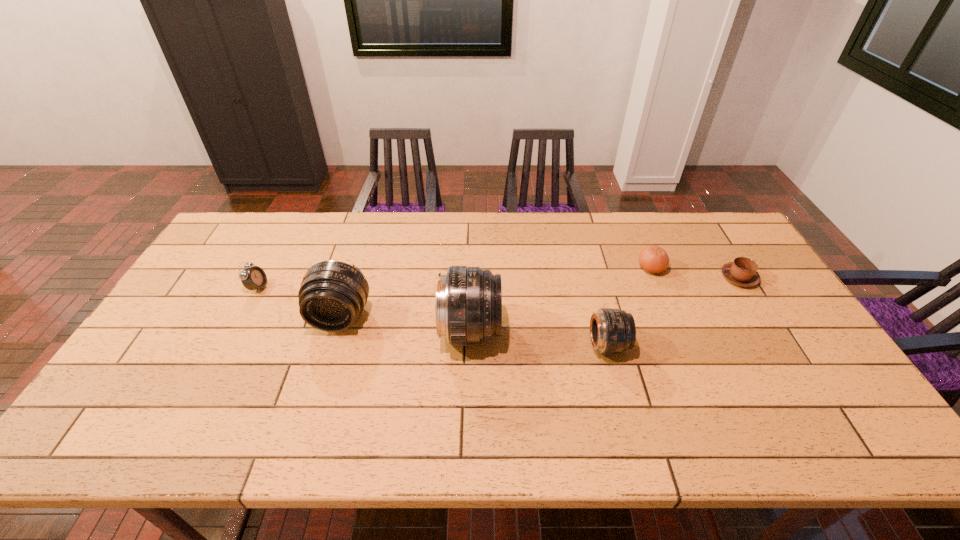
In the image, there is a desktop. Where is `free space at the far edge`? free space at the far edge is located at coordinates pyautogui.click(x=556, y=248).

This screenshot has width=960, height=540. What are the coordinates of `free region at the near edge` in the screenshot? It's located at (647, 407).

I want to click on free spot at the left edge of the desktop, so click(x=161, y=360).

You are a GUI agent. You are given a task and a screenshot of the screen. Output one action in this format:
    pyautogui.click(x=<x>, y=<y>)
    Task: Click on the vacant region at the right edge of the desktop
    
    Given the screenshot: What is the action you would take?
    pyautogui.click(x=817, y=357)

In the image, there is a desktop. What are the coordinates of `vacant space at the far left corner` in the screenshot? It's located at (240, 217).

The image size is (960, 540). Find the location of `free region at the near left corner`. free region at the near left corner is located at coordinates (110, 409).

Locate an element on the screen. The height and width of the screenshot is (540, 960). blank region between the fourth object from right to left and the shortest object is located at coordinates (604, 305).

This screenshot has width=960, height=540. What are the coordinates of `blank region between the rightmost object and the second object from left to right` in the screenshot? It's located at (540, 298).

This screenshot has height=540, width=960. Identify the location of free space between the fifth object from right to left and the rightmost object. (540, 298).

Where is `blank region between the shortest object and the second telephoto lens from left to right`? blank region between the shortest object and the second telephoto lens from left to right is located at coordinates (604, 305).